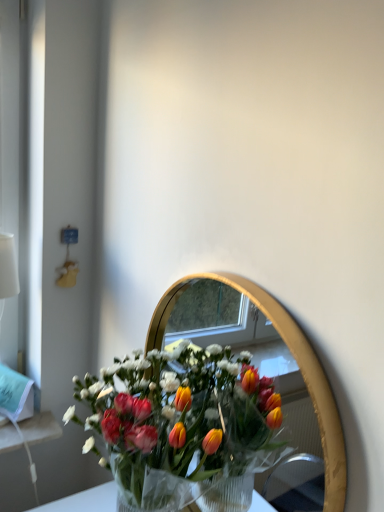
Describe the element at coordinates (183, 410) in the screenshot. The height and width of the screenshot is (512, 384). I see `translucent plastic bouquet at center` at that location.

What are the coordinates of `translucent plastic bouquet at center` in the screenshot? It's located at (183, 410).

The image size is (384, 512). What do you see at coordinates (247, 349) in the screenshot?
I see `gold metallic mirror at center` at bounding box center [247, 349].

Identify the location of gold metallic mirror at center. (247, 349).

The image size is (384, 512). I want to click on translucent plastic bouquet at center, so click(183, 410).

Is gold metallic mirror at center to the right of translucent plastic bouquet at center from the viewer's perspective?

Yes, gold metallic mirror at center is to the right of translucent plastic bouquet at center.

Relative to translucent plastic bouquet at center, is gold metallic mirror at center in front or behind?

gold metallic mirror at center is in front of translucent plastic bouquet at center.

Which is nearer, (296, 468) or (138, 431)?

The point (138, 431) is in front.

From the image's perspective, is gold metallic mirror at center located beneath translucent plastic bouquet at center?

No, from the image's perspective, gold metallic mirror at center is not beneath translucent plastic bouquet at center.

From a real-world perspective, is gold metallic mirror at center positioned under translucent plastic bouquet at center based on gravity?

Actually, gold metallic mirror at center is physically above translucent plastic bouquet at center in the real world.

Considering the relative sizes of gold metallic mirror at center and translucent plastic bouquet at center in the image provided, is gold metallic mirror at center wider than translucent plastic bouquet at center?

Incorrect, the width of gold metallic mirror at center does not surpass that of translucent plastic bouquet at center.

Can you confirm if gold metallic mirror at center is taller than translucent plastic bouquet at center?

Yes, gold metallic mirror at center is taller than translucent plastic bouquet at center.

Does gold metallic mirror at center have a smaller size compared to translucent plastic bouquet at center?

Yes.

Is gold metallic mirror at center spatially inside translucent plastic bouquet at center, or outside of it?

gold metallic mirror at center cannot be found inside translucent plastic bouquet at center.

Is gold metallic mirror at center far away from translucent plastic bouquet at center?

No, gold metallic mirror at center is not far from translucent plastic bouquet at center.

Based on the photo, is gold metallic mirror at center looking in the opposite direction of translucent plastic bouquet at center?

Yes, gold metallic mirror at center's orientation is away from translucent plastic bouquet at center.

How many degrees apart are the facing directions of gold metallic mirror at center and translucent plastic bouquet at center?

There is a 1.65-degree angle between the facing directions of gold metallic mirror at center and translucent plastic bouquet at center.

Find the location of a particular element. The height and width of the screenshot is (512, 384). mirror above the translucent plastic bouquet at center (from a real-world perspective) is located at coordinates (247, 349).

Which object is positioned more to the left, translucent plastic bouquet at center or gold metallic mirror at center?

Positioned to the left is translucent plastic bouquet at center.

Is translucent plastic bouquet at center further to the viewer compared to gold metallic mirror at center?

Yes.

Which point is more forward, (92, 390) or (253, 360)?

The point (92, 390) is closer to the camera.

From the image's perspective, does translucent plastic bouquet at center appear lower than gold metallic mirror at center?

Yes, from the image's perspective, translucent plastic bouquet at center is beneath gold metallic mirror at center.

From a real-world perspective, is translucent plastic bouquet at center physically located above or below gold metallic mirror at center?

translucent plastic bouquet at center is below gold metallic mirror at center.

Considering the sizes of translucent plastic bouquet at center and gold metallic mirror at center in the image, is translucent plastic bouquet at center wider or thinner than gold metallic mirror at center?

Considering their sizes, translucent plastic bouquet at center looks broader than gold metallic mirror at center.

Can you confirm if translucent plastic bouquet at center is shorter than gold metallic mirror at center?

Yes, translucent plastic bouquet at center is shorter than gold metallic mirror at center.

In terms of size, does translucent plastic bouquet at center appear bigger or smaller than gold metallic mirror at center?

translucent plastic bouquet at center is bigger than gold metallic mirror at center.

Can we say translucent plastic bouquet at center lies outside gold metallic mirror at center?

Indeed, translucent plastic bouquet at center is completely outside gold metallic mirror at center.

Is translucent plastic bouquet at center touching gold metallic mirror at center?

translucent plastic bouquet at center and gold metallic mirror at center are not in contact.

Is translucent plastic bouquet at center looking in the opposite direction of gold metallic mirror at center?

That's right, translucent plastic bouquet at center is facing away from gold metallic mirror at center.

How many degrees apart are the facing directions of translucent plastic bouquet at center and gold metallic mirror at center?

1.65 degrees separate the facing orientations of translucent plastic bouquet at center and gold metallic mirror at center.

Measure the distance between translucent plastic bouquet at center and gold metallic mirror at center.

translucent plastic bouquet at center is 33.21 inches from gold metallic mirror at center.

Image resolution: width=384 pixels, height=512 pixels. What are the coordinates of `flower that appears below the gold metallic mirror at center (from the image's perspective)` in the screenshot? It's located at (183, 410).

Where is `mirror above the translucent plastic bouquet at center (from a real-world perspective)`? mirror above the translucent plastic bouquet at center (from a real-world perspective) is located at coordinates (247, 349).

The width and height of the screenshot is (384, 512). I want to click on mirror on the right of translucent plastic bouquet at center, so click(x=247, y=349).